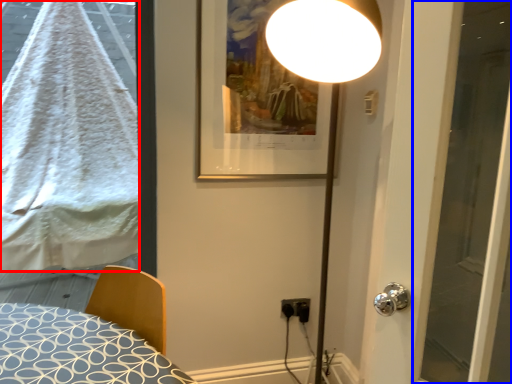
Question: Which point is further to the camera, blanket (highlighted by a red box) or screen door (highlighted by a blue box)?

Choices:
 (A) blanket
 (B) screen door

Answer: (A)